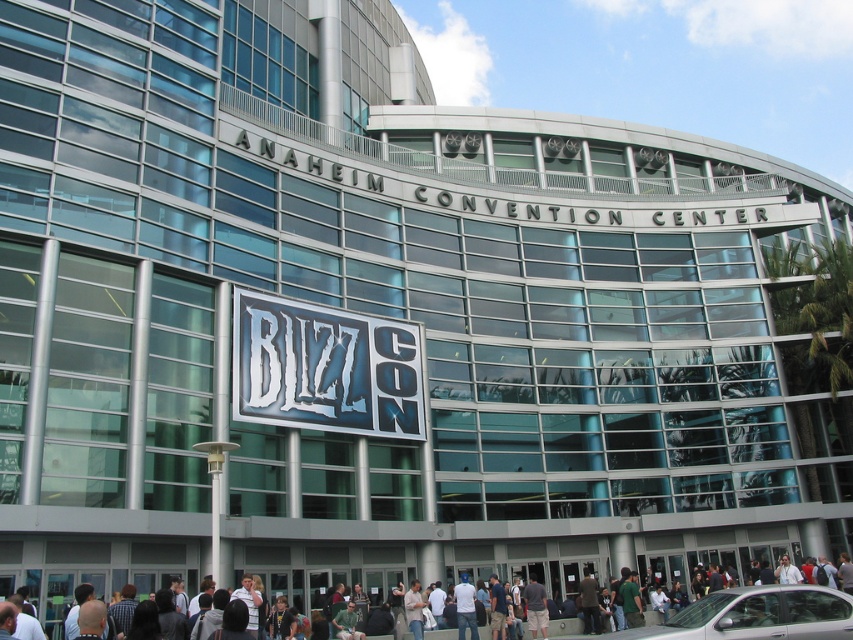
Question: Is silver metallic car at lower right to the left of dark blue shirt at lower center from the viewer's perspective?

Choices:
 (A) no
 (B) yes

Answer: (A)

Question: Is silver metallic car at lower right above dark blue shirt at lower center?

Choices:
 (A) yes
 (B) no

Answer: (A)

Question: Is silver metallic car at lower right further to the viewer compared to dark blue shirt at lower center?

Choices:
 (A) no
 (B) yes

Answer: (A)